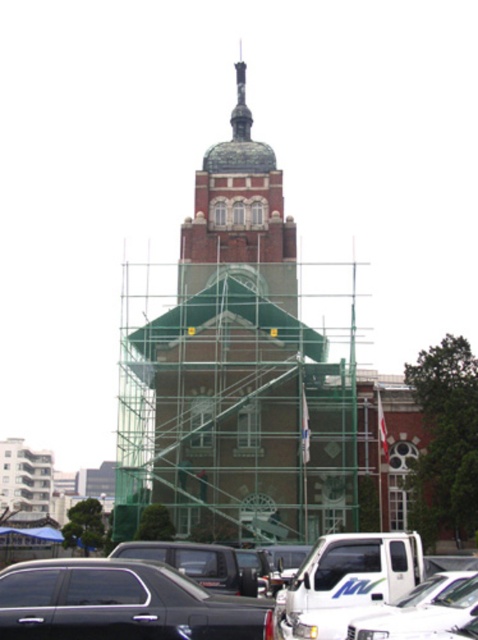
You are standing at the base of the brown brick tower at center. You want to take a photo of the tower with a camera that has a maximum focus range of 80 meters. Will the camera be able to focus on the tower from your current position?

The brown brick tower at center and camera are 85.91 meters apart from each other. Since the camera can only focus up to 80 meters, it cannot focus on the tower from your current position.